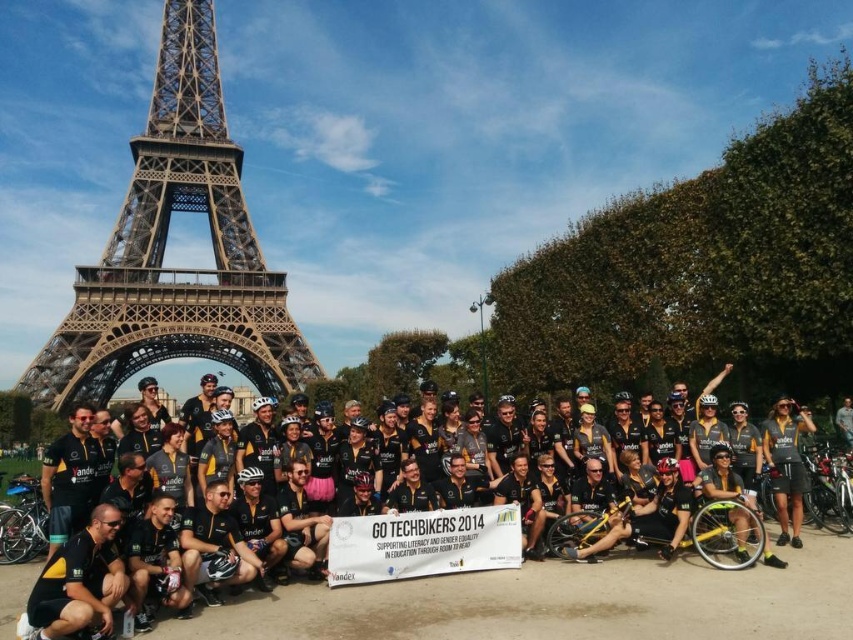
Does metallic brown eiffel tower at center appear on the right side of black matte jersey at center?

In fact, metallic brown eiffel tower at center is to the left of black matte jersey at center.

Does metallic brown eiffel tower at center lie behind black matte jersey at center?

Yes.

Who is more forward, (192, 328) or (416, 632)?

Point (416, 632) is in front.

At what (x,y) coordinates should I click in order to perform the action: click on metallic brown eiffel tower at center. Please return your answer as a coordinate pair (x, y). Looking at the image, I should click on (164, 248).